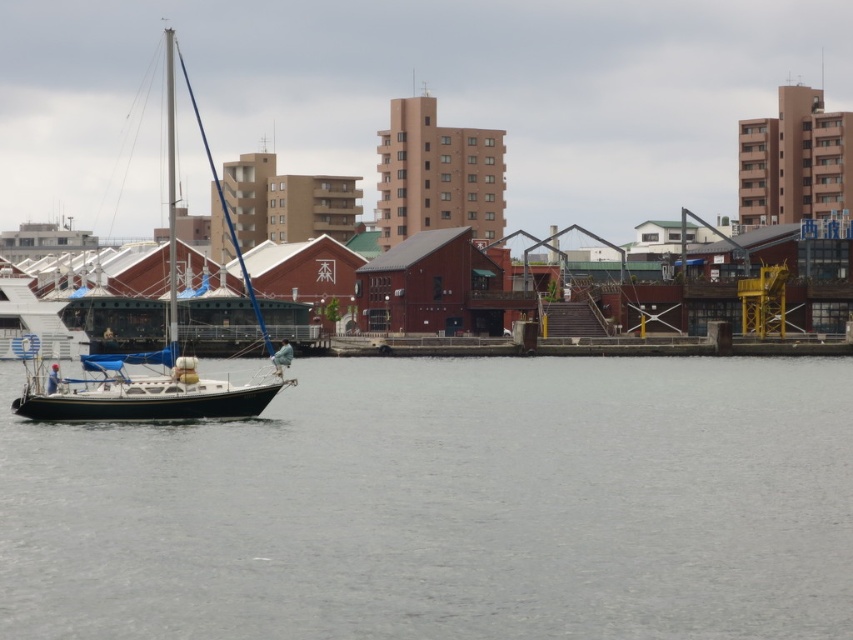
Question: Among these objects, which one is farthest from the camera?

Choices:
 (A) white matte sailboat at center
 (B) clear water at lower left

Answer: (A)

Question: In this image, where is clear water at lower left located relative to white matte sailboat at center?

Choices:
 (A) above
 (B) below

Answer: (B)

Question: Does clear water at lower left appear on the left side of white matte sailboat at center?

Choices:
 (A) no
 (B) yes

Answer: (A)

Question: Which point is closer to the camera?

Choices:
 (A) clear water at lower left
 (B) white matte sailboat at center

Answer: (A)

Question: Which of the following is the closest to the observer?

Choices:
 (A) (271, 534)
 (B) (93, 365)

Answer: (A)

Question: Does clear water at lower left appear over white matte sailboat at center?

Choices:
 (A) yes
 (B) no

Answer: (B)